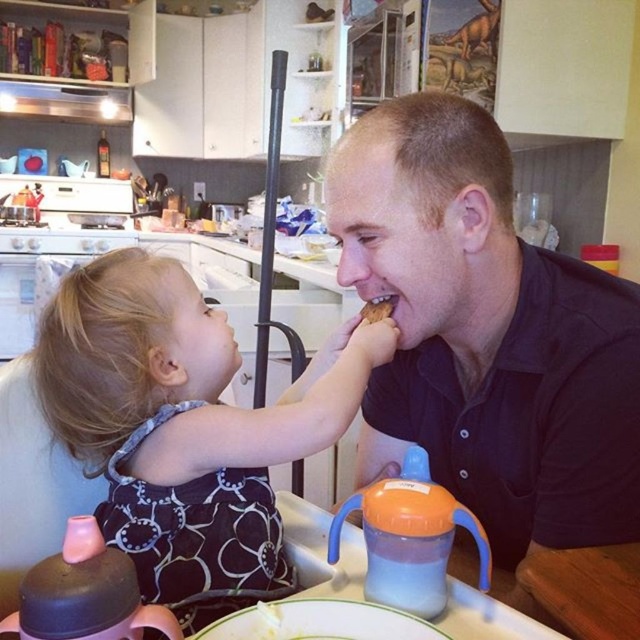
You are a delivery person who just arrived at a house. You see a matte black dress at center in the kitchen. Where would you place the dress to avoid blocking the vacuum cleaner pole in the center?

The matte black dress at center is located at point (184, 428). To avoid blocking the vacuum cleaner pole in the center, you should move the dress slightly away from the center point, perhaps to the left or right side of the kitchen.

You are a chef observing the scene in the kitchen. You notice the black matte shirt at center and the brown crumbly bread at mouth. Which object is closer to the viewer?

The black matte shirt at center is closer to the viewer because it is in front of the brown crumbly bread at mouth.

You are a delivery person who needs to place a small package between the black matte shirt at center and the matte black dress at center. Can you fit the package in the space between them?

The black matte shirt at center is 9.07 inches away from the matte black dress at center. If the package is smaller than 9.07 inches in width, it can fit between them.